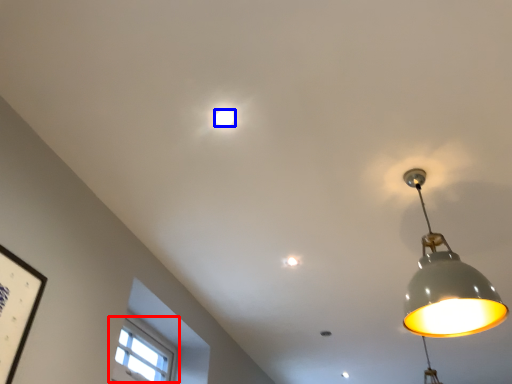
Question: Which point is further to the camera, window (highlighted by a red box) or lamp (highlighted by a blue box)?

Choices:
 (A) window
 (B) lamp

Answer: (A)